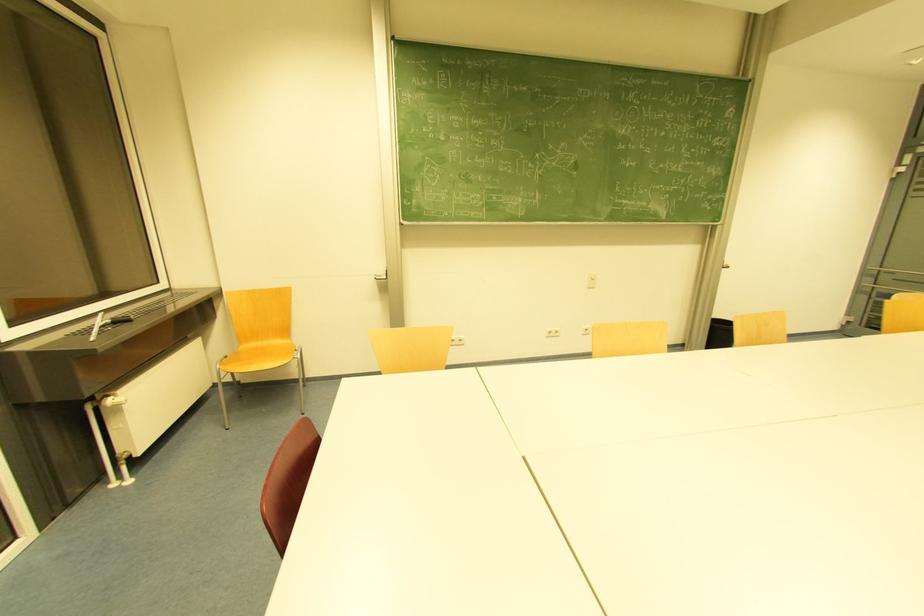
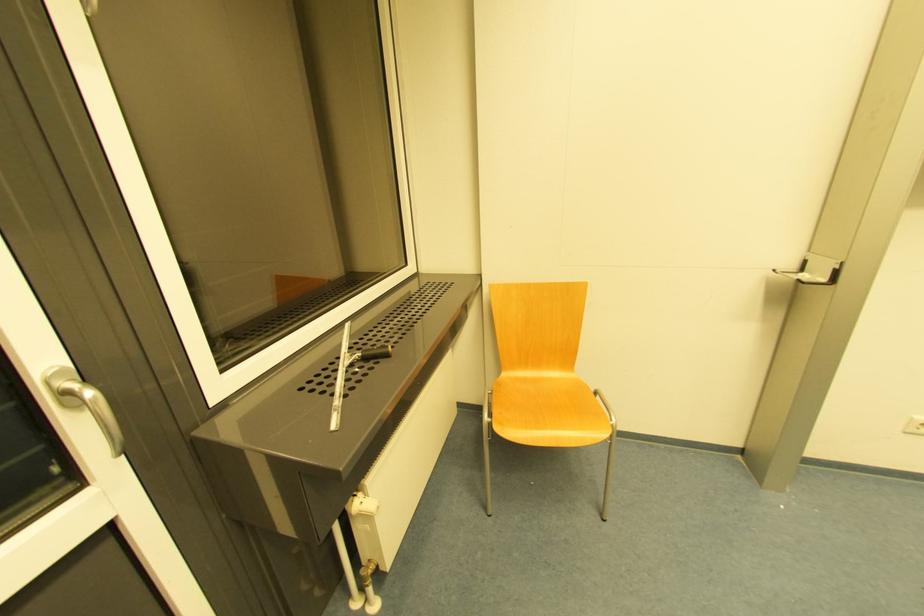
The images are taken continuously from a first-person perspective. In which direction are you moving?

The cameraman moved toward left, forward.